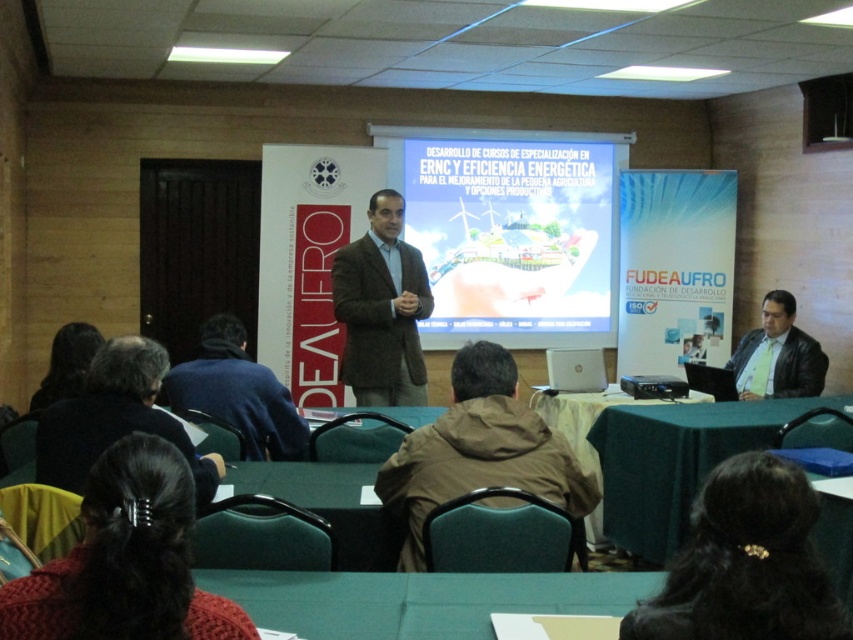
You are a presenter standing on stage and need to move from your current position to the exit door located behind the audience. There is a 3.5 feet wide path between the knitted red sweater at lower center and dark brown hair at lower left. Can you pass through this path without squeezing?

The distance between the knitted red sweater at lower center and dark brown hair at lower left is 3.46 feet. Since the path is slightly narrower than the required 3.5 feet, you would need to squeeze to pass through.

You are organizing a photo shoot in this conference room and need to ensure that the brown fabric jacket at center and the dark brown hair at lower left are both visible in the frame. Given their sizes, which object should you prioritize positioning closer to the camera to maintain clarity?

The brown fabric jacket at center is larger in width than the dark brown hair at lower left, so you should prioritize positioning the brown fabric jacket at center closer to the camera to maintain clarity.

You are an attendee sitting at the front row of the conference room. You notice the knitted red sweater at lower center and the dark brown hair at lower left. Which object is closer to you?

The knitted red sweater at lower center is closer to you because it is positioned over the dark brown hair at lower left, indicating it is in front.